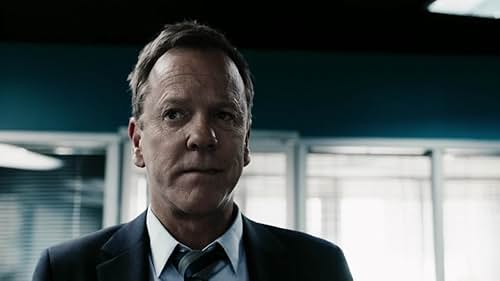
Identify the location of windows. [30, 200], [274, 184], [264, 212], [143, 202], [366, 218], [382, 233], [465, 227], [472, 246].